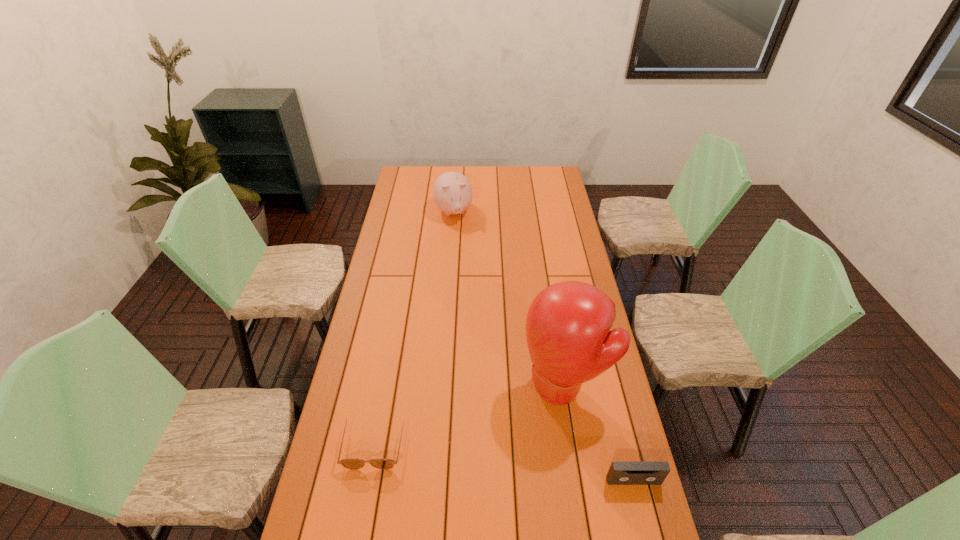
Find the location of a particular element. The height and width of the screenshot is (540, 960). vacant spot on the desktop that is between the leftmost object and the third tallest object and is positioned at the snout of the farthest object is located at coordinates (528, 464).

Image resolution: width=960 pixels, height=540 pixels. I want to click on free space on the desktop that is between the shortest object and the third tallest object and is positioned on the striking surface of the boxing glove, so click(x=466, y=455).